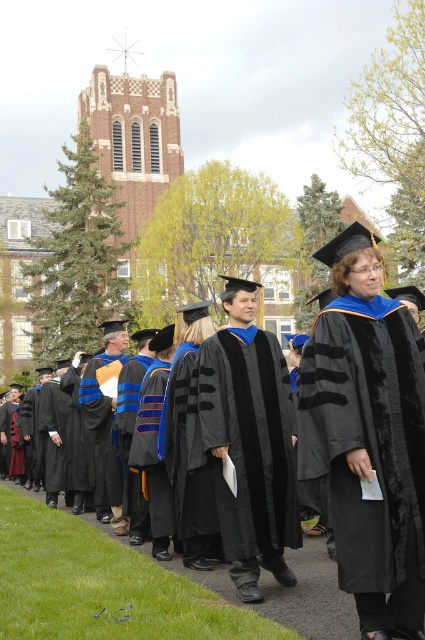
Question: Is velvety black gown at center further to the viewer compared to matte black graduation gown at center?

Choices:
 (A) yes
 (B) no

Answer: (B)

Question: From the image, what is the correct spatial relationship of velvety black gown at center in relation to matte black gown at center?

Choices:
 (A) above
 (B) below

Answer: (A)

Question: Which object is farther from the camera taking this photo?

Choices:
 (A) matte black gown at center
 (B) velvet black gown at center
 (C) matte black graduation gown at center

Answer: (C)

Question: Which object appears farthest from the camera in this image?

Choices:
 (A) matte black graduation gown at center
 (B) velvet black gown at center
 (C) black matte graduation gown at center

Answer: (A)

Question: Is velvet black gown at center thinner than black matte graduation gown at center?

Choices:
 (A) no
 (B) yes

Answer: (A)

Question: Which object appears farthest from the camera in this image?

Choices:
 (A) velvet black gown at center
 (B) matte black gown at center
 (C) black matte graduation gown at center

Answer: (C)